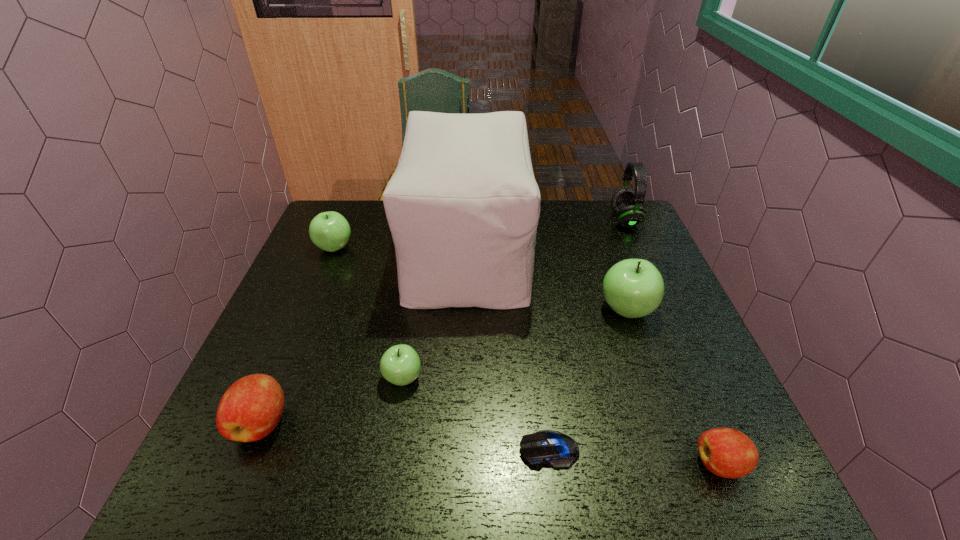
Identify the location of vacant area situated 0.150m on the front of the nearest green apple. Image resolution: width=960 pixels, height=540 pixels. (389, 464).

At what (x,y) coordinates should I click in order to perform the action: click on vacant space located on the back of the right red apple. Please return your answer as a coordinate pair (x, y). Looking at the image, I should click on (660, 321).

Identify the location of free space located 0.390m on the button side of the shortest object. (314, 449).

The width and height of the screenshot is (960, 540). In order to click on vacant space located 0.190m on the button side of the shortest object in this screenshot , I will do `click(420, 449)`.

This screenshot has width=960, height=540. Find the location of `vacant area situated on the button side of the shortest object`. vacant area situated on the button side of the shortest object is located at coordinates (482, 449).

In order to click on cushion present at the far edge in this screenshot , I will do `click(463, 206)`.

Identify the location of headset that is positioned at the far edge. (626, 203).

The width and height of the screenshot is (960, 540). Identify the location of apple at the far edge. (330, 231).

The width and height of the screenshot is (960, 540). Identify the location of apple that is at the near edge. (729, 453).

Find the location of `computer mouse located at the near edge`. computer mouse located at the near edge is located at coordinates (557, 450).